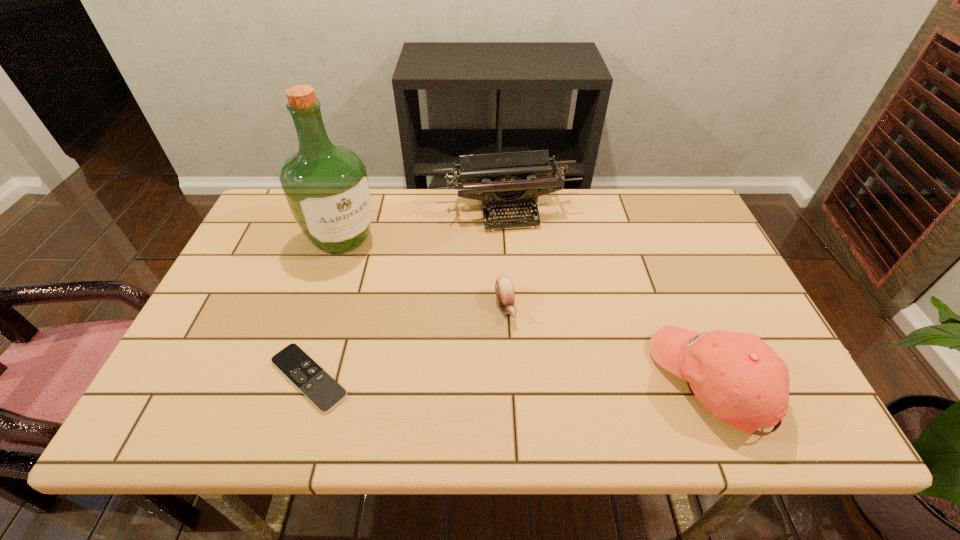
Find the location of a particular element. Image resolution: width=960 pixels, height=540 pixels. typewriter that is at the far edge is located at coordinates (505, 180).

The width and height of the screenshot is (960, 540). What are the coordinates of `remote control that is positioned at the near edge` in the screenshot? It's located at (316, 384).

Locate an element on the screen. baseball cap that is at the near edge is located at coordinates (740, 379).

Locate an element on the screen. The image size is (960, 540). object that is positioned at the left edge is located at coordinates (327, 187).

The image size is (960, 540). I want to click on object that is at the right edge, so click(740, 379).

The height and width of the screenshot is (540, 960). I want to click on object present at the far left corner, so click(x=327, y=187).

Locate an element on the screen. object that is at the near right corner is located at coordinates (740, 379).

The width and height of the screenshot is (960, 540). What are the coordinates of `free space at the far edge of the desktop` in the screenshot? It's located at (400, 189).

In order to click on free spot at the near edge of the desktop in this screenshot , I will do `click(260, 385)`.

Identify the location of vacant point at the left edge. The image size is (960, 540). (245, 343).